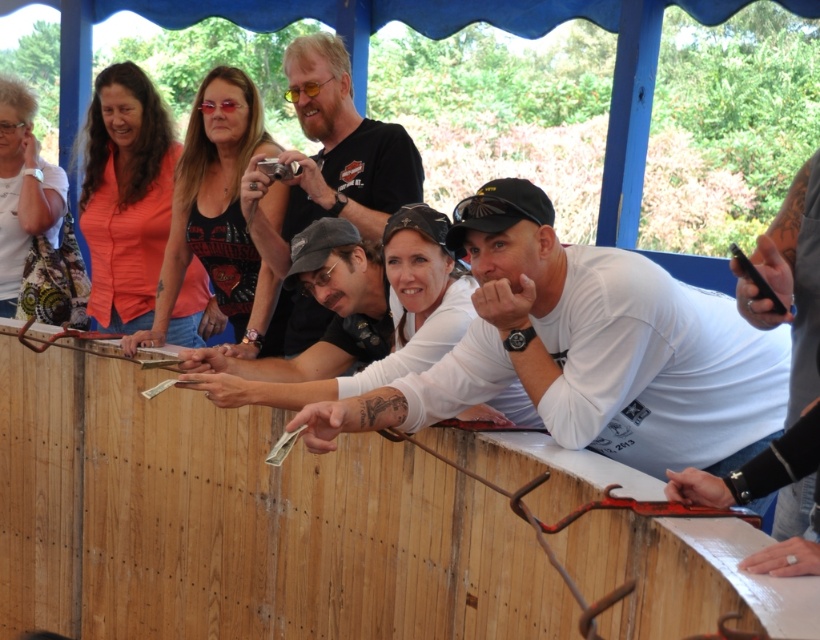
You are standing at point [329,125]. You need to reach a point that is 12.93 feet away. Is this distance within a comfortable reaching distance for an average adult?

The distance between the two points is 12.93 feet, which is significantly beyond the typical comfortable reaching distance for an average adult, as most people can reach about 3 feet comfortably.